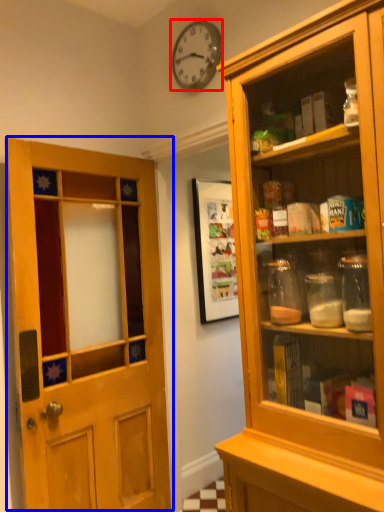
Question: Which object is closer to the camera taking this photo, clock (highlighted by a red box) or door (highlighted by a blue box)?

Choices:
 (A) clock
 (B) door

Answer: (B)